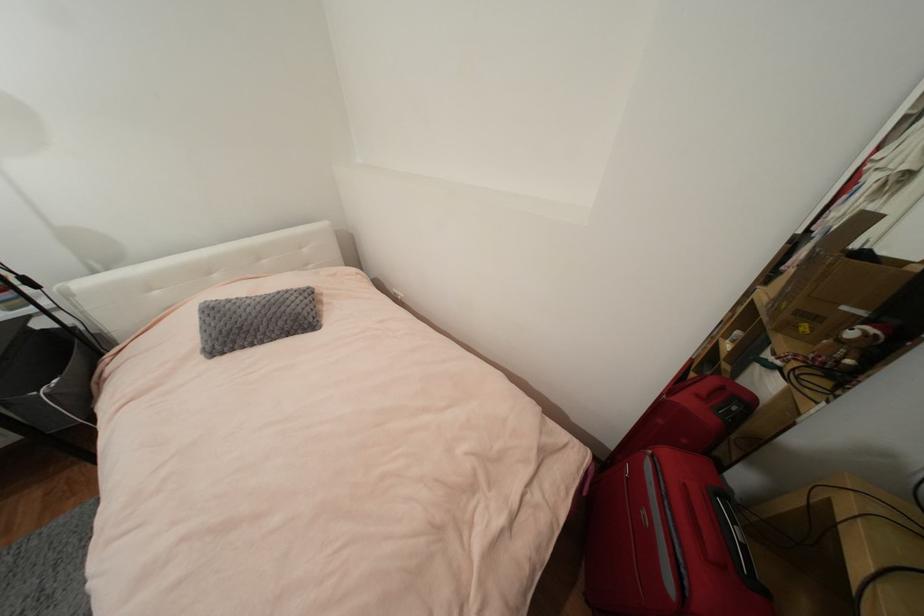
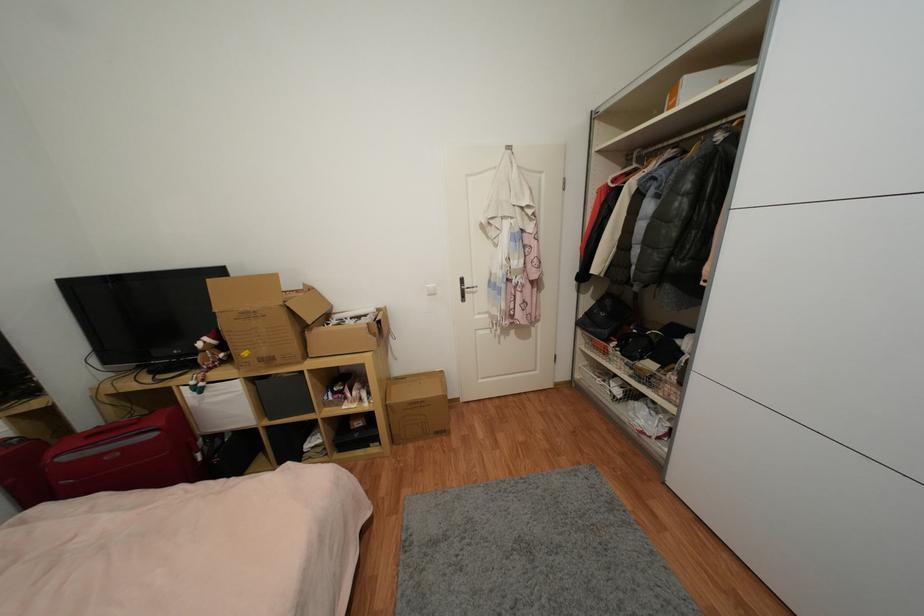
Find the pixel in the second image that matches the point at 675,588 in the first image.

(157, 436)